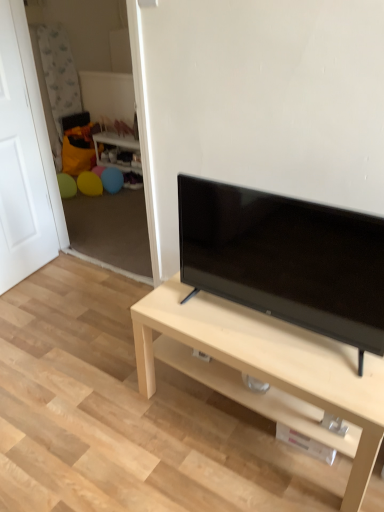
Image resolution: width=384 pixels, height=512 pixels. Find the location of `white matte door at left`. white matte door at left is located at coordinates (21, 157).

What do you see at coordinates (266, 368) in the screenshot?
I see `light wood/finish tv stand at center` at bounding box center [266, 368].

The height and width of the screenshot is (512, 384). What do you see at coordinates (117, 151) in the screenshot? I see `wooden side table at center` at bounding box center [117, 151].

Locate an element on the screen. black glossy tv at center is located at coordinates (286, 259).

You are a GUI agent. You are given a task and a screenshot of the screen. Output one action in this format:
    pyautogui.click(x=<x>, y=<y>)
    Task: Click on the white matte door at left
    The width and height of the screenshot is (384, 512).
    Given the screenshot: What is the action you would take?
    pyautogui.click(x=21, y=157)

Is light wood/finish tv stand at center oriented away from black glossy tv at center?

light wood/finish tv stand at center does not have its back to black glossy tv at center.

Are light wood/finish tv stand at center and black glossy tv at center beside each other?

No, light wood/finish tv stand at center is not in contact with black glossy tv at center.

Does light wood/finish tv stand at center contain black glossy tv at center?

Actually, black glossy tv at center is outside light wood/finish tv stand at center.

Relative to black glossy tv at center, is light wood/finish tv stand at center in front or behind?

light wood/finish tv stand at center is positioned farther from the viewer than black glossy tv at center.

Does white matte door at left have a lesser height compared to black glossy tv at center?

Incorrect, the height of white matte door at left does not fall short of that of black glossy tv at center.

Is white matte door at left to the left of black glossy tv at center from the viewer's perspective?

Yes.

Which of these two, white matte door at left or black glossy tv at center, is bigger?

With larger size is white matte door at left.

Could you tell me if black glossy tv at center is facing wooden side table at center?

No.

Considering the relative sizes of black glossy tv at center and wooden side table at center in the image provided, is black glossy tv at center bigger than wooden side table at center?

No.

The image size is (384, 512). Find the location of `side table on the left of black glossy tv at center`. side table on the left of black glossy tv at center is located at coordinates (117, 151).

Does black glossy tv at center have a greater height compared to wooden side table at center?

Yes.

Consider the image. From a real-world perspective, is black glossy tv at center positioned under light wood/finish tv stand at center based on gravity?

Incorrect, from a real-world perspective, black glossy tv at center is higher than light wood/finish tv stand at center.

In the image, is black glossy tv at center on the left side or the right side of light wood/finish tv stand at center?

black glossy tv at center is to the left of light wood/finish tv stand at center.

Is black glossy tv at center inside or outside of light wood/finish tv stand at center?

black glossy tv at center cannot be found inside light wood/finish tv stand at center.

Who is shorter, black glossy tv at center or light wood/finish tv stand at center?

Standing shorter between the two is light wood/finish tv stand at center.

Is light wood/finish tv stand at center not near white matte door at left?

Yes, light wood/finish tv stand at center and white matte door at left are quite far apart.

Considering the relative sizes of light wood/finish tv stand at center and white matte door at left in the image provided, is light wood/finish tv stand at center shorter than white matte door at left?

Indeed, light wood/finish tv stand at center has a lesser height compared to white matte door at left.

In the image, is light wood/finish tv stand at center on the left side or the right side of white matte door at left?

From the image, it's evident that light wood/finish tv stand at center is to the right of white matte door at left.

Is point (242, 385) positioned before point (12, 68)?

Yes, point (242, 385) is closer to viewer.

In the scene shown: Is the depth of wooden side table at center greater than that of white matte door at left?

Yes, it is behind white matte door at left.

From the picture: Based on their positions, is wooden side table at center located to the left or right of white matte door at left?

In the image, wooden side table at center appears on the right side of white matte door at left.

Is light wood/finish tv stand at center next to wooden side table at center and touching it?

There is a gap between light wood/finish tv stand at center and wooden side table at center.

From a real-world perspective, is light wood/finish tv stand at center located higher than wooden side table at center?

Yes, from a real-world perspective, light wood/finish tv stand at center is on top of wooden side table at center.

How different are the orientations of light wood/finish tv stand at center and wooden side table at center in degrees?

There is a 1.35-degree angle between the facing directions of light wood/finish tv stand at center and wooden side table at center.

Looking at this image, from the image's perspective, is light wood/finish tv stand at center positioned above or below wooden side table at center?

light wood/finish tv stand at center is situated lower than wooden side table at center in the image.

This screenshot has width=384, height=512. I want to click on television on the left of the light wood/finish tv stand at center, so click(286, 259).

Locate an element on the screen. door behind the black glossy tv at center is located at coordinates (21, 157).

Looking at the image, which one is located further to white matte door at left, black glossy tv at center or light wood/finish tv stand at center?

Among the two, black glossy tv at center is located further to white matte door at left.

Considering their positions, is wooden side table at center positioned further to white matte door at left than light wood/finish tv stand at center?

Based on the image, light wood/finish tv stand at center appears to be further to white matte door at left.

Looking at the image, which one is located further to wooden side table at center, light wood/finish tv stand at center or white matte door at left?

light wood/finish tv stand at center lies further to wooden side table at center than the other object.

Which object lies further to the anchor point white matte door at left, wooden side table at center or black glossy tv at center?

The object further to white matte door at left is black glossy tv at center.

From the image, which object appears to be farther from wooden side table at center, white matte door at left or black glossy tv at center?

black glossy tv at center is positioned further to the anchor wooden side table at center.

When comparing their distances from wooden side table at center, does light wood/finish tv stand at center or black glossy tv at center seem further?

light wood/finish tv stand at center is further to wooden side table at center.

When comparing their distances from black glossy tv at center, does white matte door at left or light wood/finish tv stand at center seem further?

Among the two, white matte door at left is located further to black glossy tv at center.

Estimate the real-world distances between objects in this image. Which object is further from black glossy tv at center, light wood/finish tv stand at center or wooden side table at center?

The object further to black glossy tv at center is wooden side table at center.

I want to click on door positioned between light wood/finish tv stand at center and wooden side table at center from near to far, so click(21, 157).

At what (x,y) coordinates should I click in order to perform the action: click on desk between black glossy tv at center and wooden side table at center from front to back. Please return your answer as a coordinate pair (x, y). This screenshot has height=512, width=384. Looking at the image, I should click on (266, 368).

Identify the location of television between white matte door at left and light wood/finish tv stand at center. (286, 259).

The width and height of the screenshot is (384, 512). Find the location of `door between black glossy tv at center and wooden side table at center along the z-axis`. door between black glossy tv at center and wooden side table at center along the z-axis is located at coordinates (21, 157).